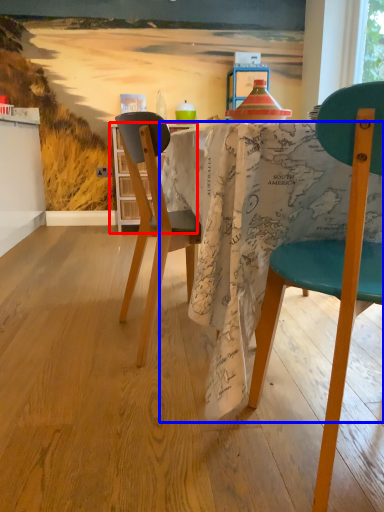
Question: Among these objects, which one is farthest to the camera, kitchen & dining room table (highlighted by a red box) or desk (highlighted by a blue box)?

Choices:
 (A) kitchen & dining room table
 (B) desk

Answer: (A)